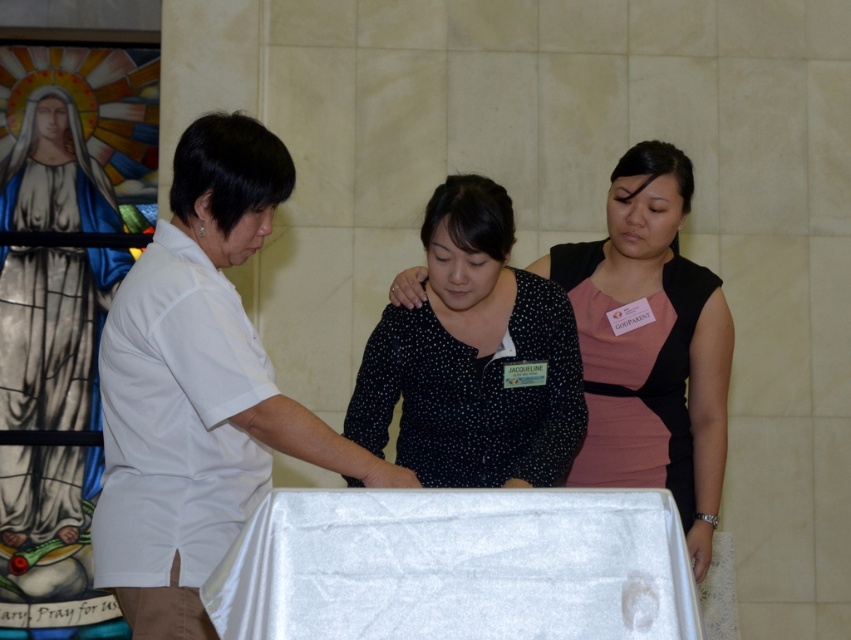
Question: Which point is farther from the camera taking this photo?

Choices:
 (A) (663, 384)
 (B) (192, 326)

Answer: (A)

Question: Estimate the real-world distances between objects in this image. Which object is closer to the black dotted blouse at center?

Choices:
 (A) white matte shirt at center
 (B) black dotted dress at center
 (C) white satin table at center

Answer: (A)

Question: Is the position of white matte shirt at center more distant than that of black dotted blouse at center?

Choices:
 (A) yes
 (B) no

Answer: (B)

Question: Which object is positioned closest to the black dotted blouse at center?

Choices:
 (A) black dotted dress at center
 (B) white matte shirt at center
 (C) white satin table at center

Answer: (B)

Question: Can you confirm if white matte shirt at center is positioned to the left of white satin table at center?

Choices:
 (A) no
 (B) yes

Answer: (B)

Question: Is white satin table at center positioned in front of black dotted blouse at center?

Choices:
 (A) yes
 (B) no

Answer: (A)